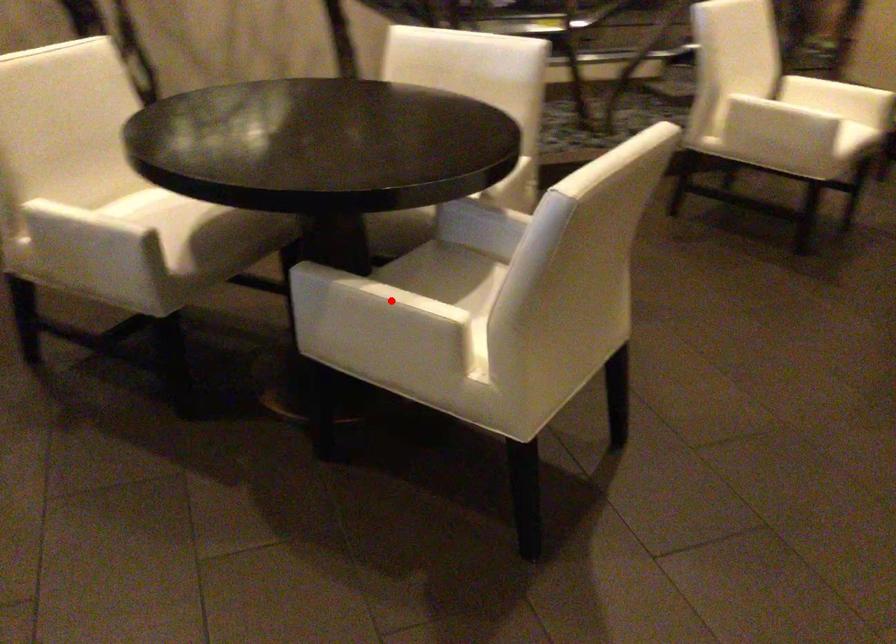
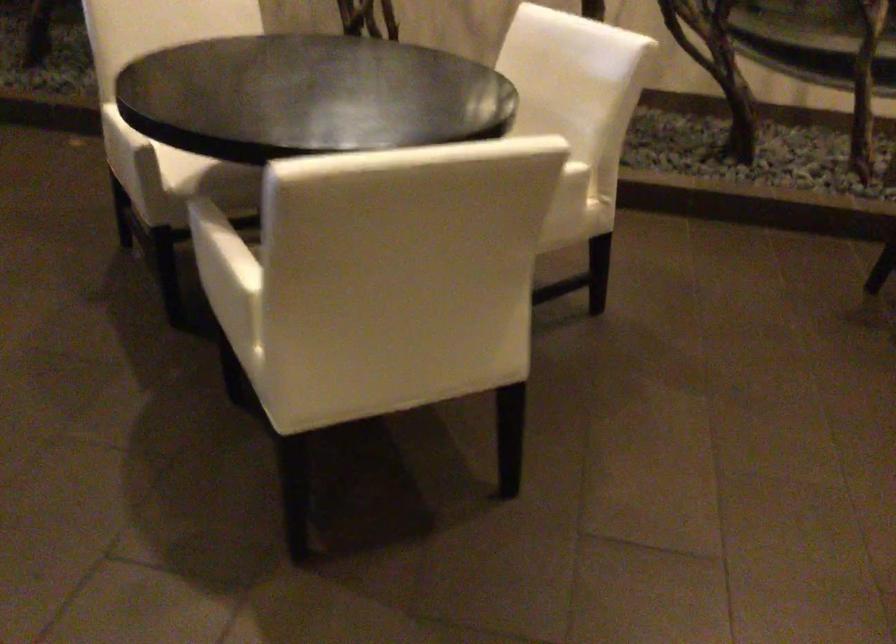
Locate, in the second image, the point that corresponds to the highlighted location in the first image.

(220, 249)